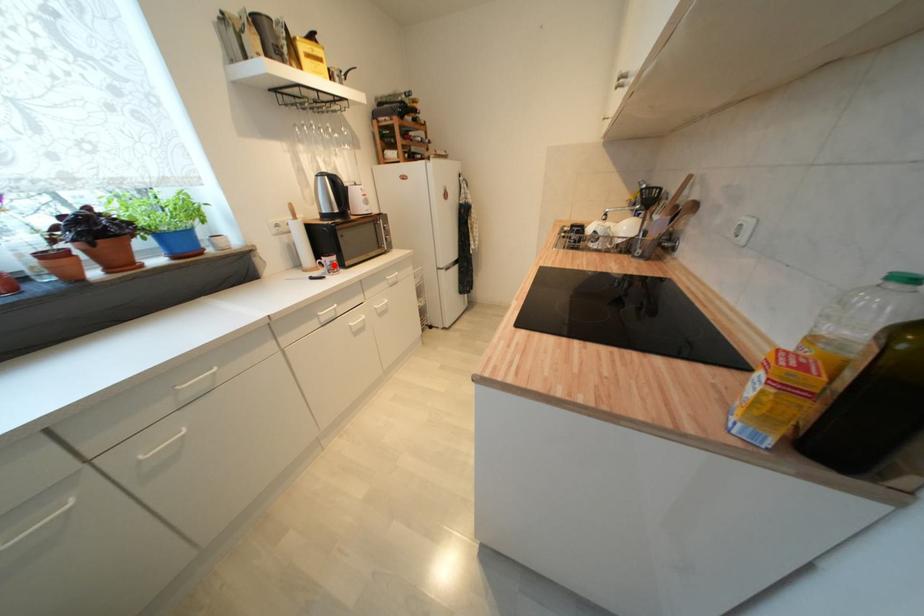
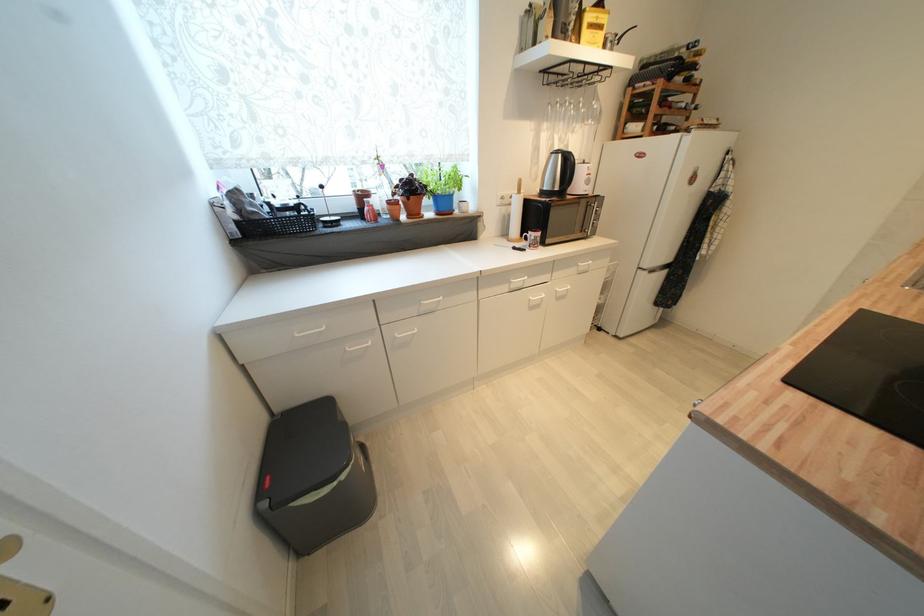
Question: I am providing you with two images of the same scene from different viewpoints. In image1, a red point is highlighted. Considering the same 3D point in image2, which of the following is correct?

Choices:
 (A) It is closer
 (B) It is farther

Answer: (B)